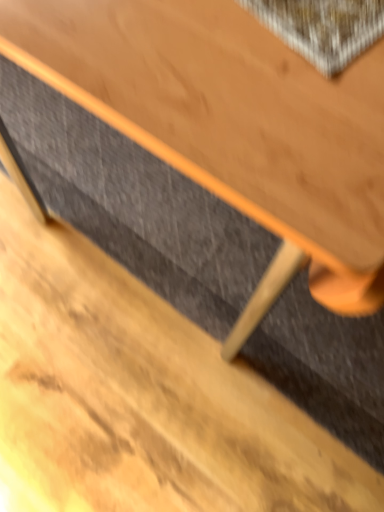
I want to click on free spot below wooden table at center (from a real-world perspective), so click(x=182, y=225).